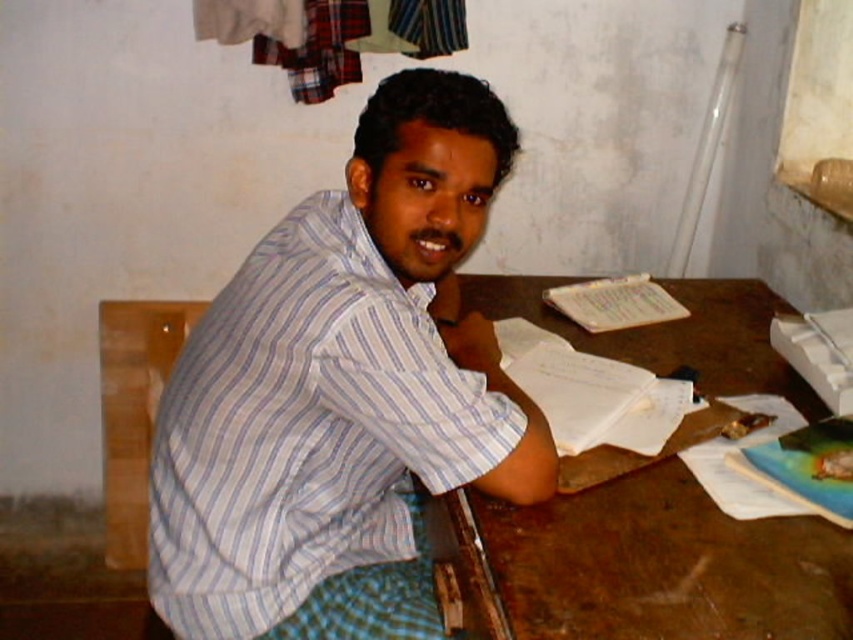
Is white striped shirt at center positioned at the back of brown wooden table at center?

Yes.

Between point (189, 417) and point (662, 468), which one is positioned behind?

The point (662, 468) is behind.

Between point (457, 225) and point (833, 634), which one is positioned in front?

Point (833, 634)

Where is `white striped shirt at center`? white striped shirt at center is located at coordinates (341, 378).